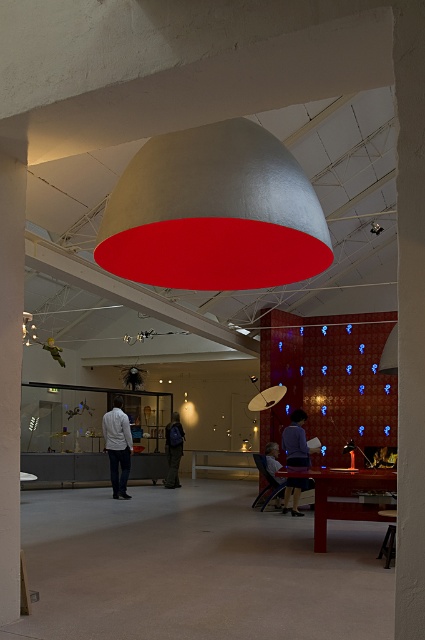
Question: Which object appears closest to the camera in this image?

Choices:
 (A) matte red table at lower center
 (B) blue backpack at center

Answer: (A)

Question: Based on their relative distances, which object is nearer to the blue fabric shirt at center?

Choices:
 (A) blue backpack at center
 (B) white matte jacket at center
 (C) matte red table at lower center
 (D) matte black shirt at lower center

Answer: (D)

Question: Can you confirm if white concrete pillar at center is wider than white matte jacket at center?

Choices:
 (A) no
 (B) yes

Answer: (A)

Question: Can you confirm if matte red table at lower center is bigger than blue fabric shirt at center?

Choices:
 (A) no
 (B) yes

Answer: (B)

Question: Which of these objects is positioned closest to the white glossy pillar at left?

Choices:
 (A) blue fabric shirt at center
 (B) matte red table at lower center

Answer: (B)

Question: Can you confirm if matte red table at lower center is bigger than blue fabric shirt at center?

Choices:
 (A) yes
 (B) no

Answer: (A)